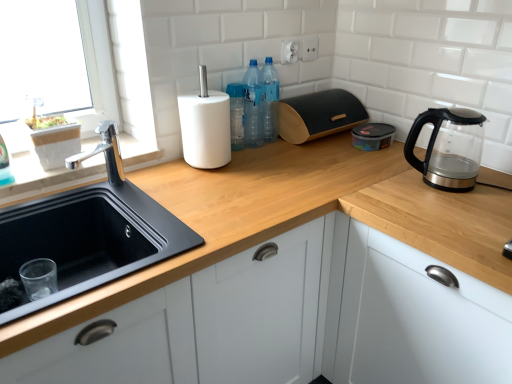
Question: Should I look upward or downward to see white matte cabinet at lower right?

Choices:
 (A) down
 (B) up

Answer: (A)

Question: Can you confirm if transparent glass kettle at right is shorter than white matte cabinet at lower right?

Choices:
 (A) yes
 (B) no

Answer: (A)

Question: From a real-world perspective, is transparent glass kettle at right located higher than white matte cabinet at lower right?

Choices:
 (A) yes
 (B) no

Answer: (A)

Question: From the image's perspective, does transparent glass kettle at right appear higher than white matte cabinet at lower right?

Choices:
 (A) yes
 (B) no

Answer: (A)

Question: Would you say transparent glass kettle at right is a long distance from white matte cabinet at lower right?

Choices:
 (A) no
 (B) yes

Answer: (A)

Question: Considering the relative sizes of transparent glass kettle at right and white matte cabinet at lower right in the image provided, is transparent glass kettle at right thinner than white matte cabinet at lower right?

Choices:
 (A) yes
 (B) no

Answer: (A)

Question: Can you confirm if transparent glass kettle at right is wider than white matte cabinet at lower right?

Choices:
 (A) yes
 (B) no

Answer: (B)

Question: From the image's perspective, does wooden at upper center appear lower than transparent glass kettle at right?

Choices:
 (A) yes
 (B) no

Answer: (A)

Question: Does wooden at upper center appear on the left side of transparent glass kettle at right?

Choices:
 (A) yes
 (B) no

Answer: (A)

Question: Is wooden at upper center oriented away from transparent glass kettle at right?

Choices:
 (A) no
 (B) yes

Answer: (A)

Question: Considering the relative positions of wooden at upper center and transparent glass kettle at right in the image provided, is wooden at upper center in front of transparent glass kettle at right?

Choices:
 (A) yes
 (B) no

Answer: (A)

Question: Is wooden at upper center thinner than transparent glass kettle at right?

Choices:
 (A) no
 (B) yes

Answer: (A)

Question: Is wooden at upper center positioned behind transparent glass kettle at right?

Choices:
 (A) yes
 (B) no

Answer: (B)

Question: From the image's perspective, is transparent glass kettle at right under black wood bread bin at upper center?

Choices:
 (A) yes
 (B) no

Answer: (A)